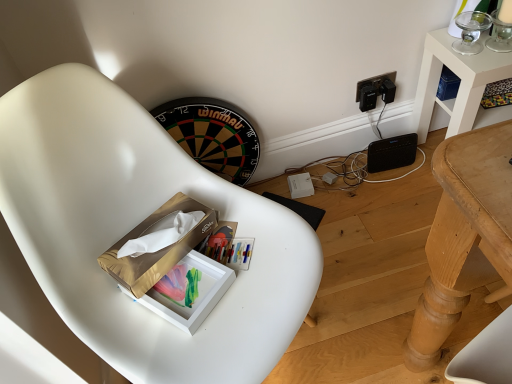
Describe the element at coordinates (188, 291) in the screenshot. I see `matte gold tissue box at center` at that location.

I want to click on white matte chair at center, so click(134, 226).

Is gold cardboard box at center outside of white matte chair at center?

No, gold cardboard box at center is inside white matte chair at center's boundary.

Does gold cardboard box at center have a lesser width compared to white matte chair at center?

Correct, the width of gold cardboard box at center is less than that of white matte chair at center.

Would you say gold cardboard box at center is a long distance from white matte chair at center?

No, there isn't a large distance between gold cardboard box at center and white matte chair at center.

Is the depth of gold cardboard box at center less than that of white matte chair at center?

No, it is not.

Between white matte chair at center and gold cardboard box at center, which one has smaller width?

gold cardboard box at center is thinner.

How many degrees apart are the facing directions of white matte chair at center and gold cardboard box at center?

The angular difference between white matte chair at center and gold cardboard box at center is 5.39 degrees.

Is white matte chair at center oriented away from gold cardboard box at center?

Absolutely, white matte chair at center is directed away from gold cardboard box at center.

At what (x,y) coordinates should I click in order to perform the action: click on box lying below the gold cardboard box at center (from the image's perspective). Please return your answer as a coordinate pair (x, y). This screenshot has height=384, width=512. Looking at the image, I should click on (188, 291).

Is matte gold tissue box at center smaller than gold cardboard box at center?

Yes, matte gold tissue box at center is smaller than gold cardboard box at center.

From the image's perspective, which one is positioned lower, matte gold tissue box at center or gold cardboard box at center?

matte gold tissue box at center appears lower in the image.

Is matte gold tissue box at center not close to gold cardboard box at center?

Actually, matte gold tissue box at center and gold cardboard box at center are a little close together.

From a real-world perspective, is gold cardboard box at center located beneath matte gold tissue box at center?

Incorrect, from a real-world perspective, gold cardboard box at center is higher than matte gold tissue box at center.

In the scene shown: Between gold cardboard box at center and matte gold tissue box at center, which one has more height?

With more height is gold cardboard box at center.

Is gold cardboard box at center wider or thinner than matte gold tissue box at center?

gold cardboard box at center is thinner than matte gold tissue box at center.

From the image's perspective, relative to matte gold tissue box at center, is gold cardboard box at center above or below?

gold cardboard box at center is above matte gold tissue box at center.

Which object is thinner, white matte chair at center or matte gold tissue box at center?

matte gold tissue box at center.

Which is closer to the camera, (x=125, y=178) or (x=159, y=299)?

The point (x=159, y=299) is closer to the camera.

The image size is (512, 384). In order to click on box on the left of the white matte chair at center in this screenshot , I will do `click(188, 291)`.

Considering the sizes of objects white matte chair at center and matte gold tissue box at center in the image provided, who is bigger, white matte chair at center or matte gold tissue box at center?

white matte chair at center is bigger.

Considering the sizes of objects matte gold tissue box at center and white matte chair at center in the image provided, who is taller, matte gold tissue box at center or white matte chair at center?

With more height is white matte chair at center.

Looking at this image, is matte gold tissue box at center not close to white matte chair at center?

matte gold tissue box at center is actually quite close to white matte chair at center.

From a real-world perspective, which object rests below the other?

white matte chair at center, from a real-world perspective.

Identify the location of chair in front of the gold cardboard box at center. (134, 226).

The height and width of the screenshot is (384, 512). Identify the location of cardboard box lying on the left of white matte chair at center. (156, 251).

In the scene shown: Based on their spatial positions, is gold cardboard box at center or white matte chair at center further from matte gold tissue box at center?

The object further to matte gold tissue box at center is white matte chair at center.

From the image, which object appears to be nearer to gold cardboard box at center, matte gold tissue box at center or white matte chair at center?

Among the two, matte gold tissue box at center is located nearer to gold cardboard box at center.

From the image, which object appears to be nearer to matte gold tissue box at center, white matte chair at center or gold cardboard box at center?

Among the two, gold cardboard box at center is located nearer to matte gold tissue box at center.

Considering their positions, is matte gold tissue box at center positioned further to white matte chair at center than gold cardboard box at center?

matte gold tissue box at center lies further to white matte chair at center than the other object.

From the picture: Estimate the real-world distances between objects in this image. Which object is further from white matte chair at center, gold cardboard box at center or matte gold tissue box at center?

matte gold tissue box at center.

Considering their positions, is white matte chair at center positioned further to gold cardboard box at center than matte gold tissue box at center?

white matte chair at center.

At what (x,y) coordinates should I click in order to perform the action: click on cardboard box between white matte chair at center and matte gold tissue box at center from front to back. Please return your answer as a coordinate pair (x, y). Looking at the image, I should click on (156, 251).